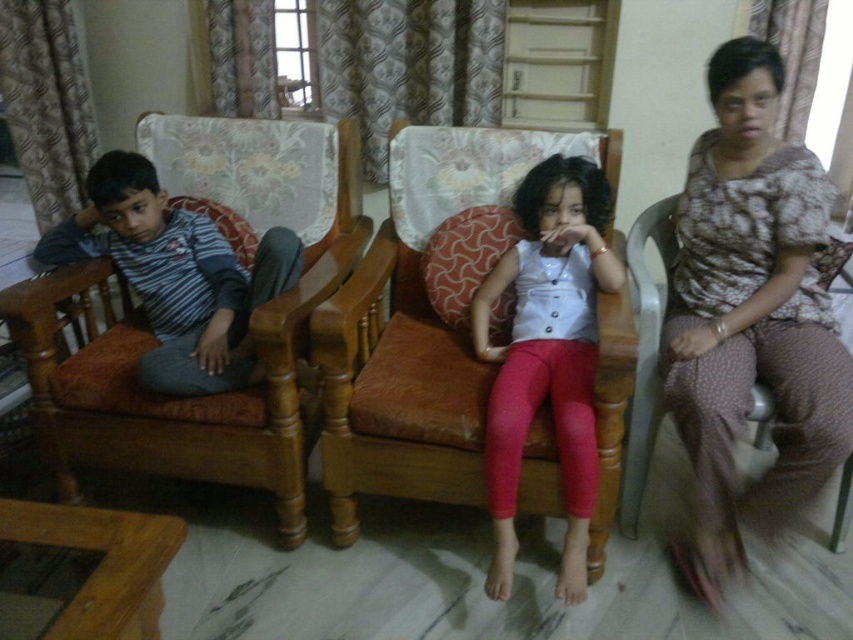
Between matte orange cushioned chair at center and matte white blouse at center, which one appears on the left side from the viewer's perspective?

Positioned to the left is matte orange cushioned chair at center.

Looking at this image, which is more to the right, matte orange cushioned chair at center or matte white blouse at center?

Positioned to the right is matte white blouse at center.

At what (x,y) coordinates should I click in order to perform the action: click on matte orange cushioned chair at center. Please return your answer as a coordinate pair (x, y). Looking at the image, I should click on (416, 328).

Identify the location of matte orange cushioned chair at center. (416, 328).

Is printed fabric blouse at right taller than matte white blouse at center?

Indeed, printed fabric blouse at right has a greater height compared to matte white blouse at center.

Consider the image. Is printed fabric blouse at right to the left of matte white blouse at center from the viewer's perspective?

No, printed fabric blouse at right is not to the left of matte white blouse at center.

This screenshot has height=640, width=853. What are the coordinates of `printed fabric blouse at right` in the screenshot? It's located at (751, 316).

Between printed fabric blouse at right and wooden armchair at left, which one appears on the right side from the viewer's perspective?

Positioned to the right is printed fabric blouse at right.

Is printed fabric blouse at right to the right of wooden armchair at left from the viewer's perspective?

Correct, you'll find printed fabric blouse at right to the right of wooden armchair at left.

Which is in front, point (689, 364) or point (257, 195)?

Point (689, 364) is more forward.

You are a GUI agent. You are given a task and a screenshot of the screen. Output one action in this format:
    pyautogui.click(x=<x>, y=<y>)
    Task: Click on the printed fabric blouse at right
    This screenshot has width=853, height=640.
    Given the screenshot: What is the action you would take?
    pyautogui.click(x=751, y=316)